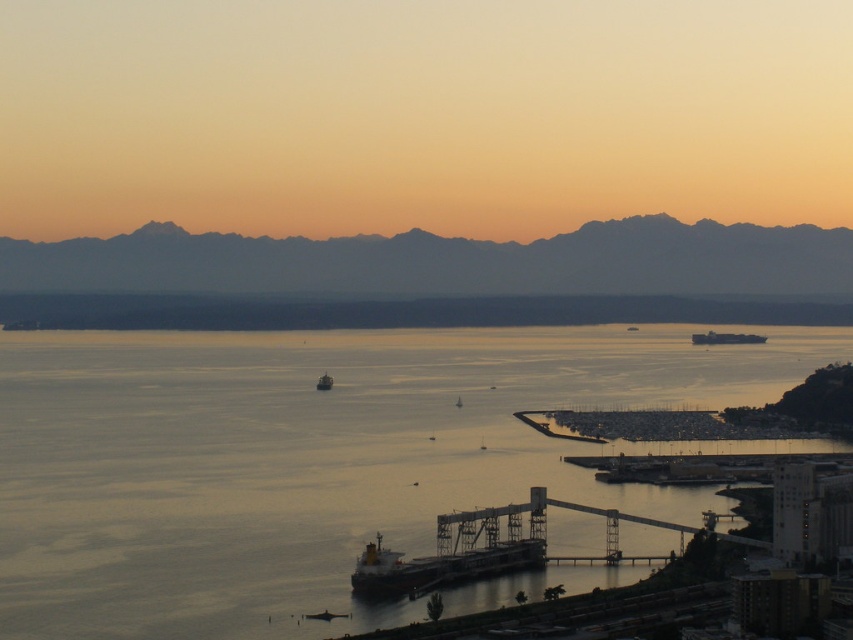
Question: Is smooth water at center wider than smooth gray boat at right?

Choices:
 (A) yes
 (B) no

Answer: (A)

Question: Among these objects, which one is farthest from the camera?

Choices:
 (A) metallic gray ship at center
 (B) dark gray horizon at center

Answer: (B)

Question: Is dark gray horizon at center behind smooth gray boat at right?

Choices:
 (A) no
 (B) yes

Answer: (A)

Question: Which is farther from the gray/distant mountain range at upper center?

Choices:
 (A) dark gray horizon at center
 (B) smooth water at center
 (C) smooth gray boat at right
 (D) metallic gray ship at center

Answer: (D)

Question: Considering the relative positions of smooth water at center and gray/distant mountain range at upper center in the image provided, where is smooth water at center located with respect to gray/distant mountain range at upper center?

Choices:
 (A) below
 (B) above

Answer: (A)

Question: Which of the following is the closest to the observer?

Choices:
 (A) (129, 272)
 (B) (325, 376)

Answer: (B)